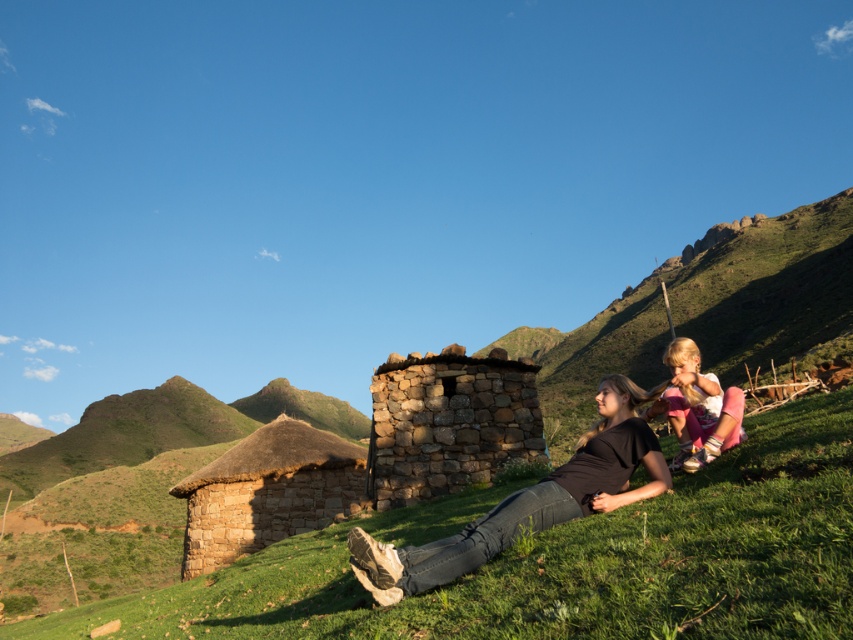
Does thatched straw hut at center have a smaller size compared to light pink fabric at lower right?

No, thatched straw hut at center is not smaller than light pink fabric at lower right.

Who is more forward, (331, 442) or (689, 362)?

Point (689, 362)

This screenshot has width=853, height=640. Find the location of `thatched straw hut at center`. thatched straw hut at center is located at coordinates (265, 492).

Is green grassy at lower center below light pink fabric at lower right?

Yes, green grassy at lower center is below light pink fabric at lower right.

Who is more forward, (374, 522) or (676, 400)?

Point (676, 400)

Measure the distance between point (693, 577) and camera.

Point (693, 577) is 27.02 feet from camera.

Locate an element on the screen. Image resolution: width=853 pixels, height=640 pixels. green grassy at lower center is located at coordinates click(564, 561).

I want to click on green grassy at lower center, so click(564, 561).

The height and width of the screenshot is (640, 853). Identify the location of green grassy at lower center. (564, 561).